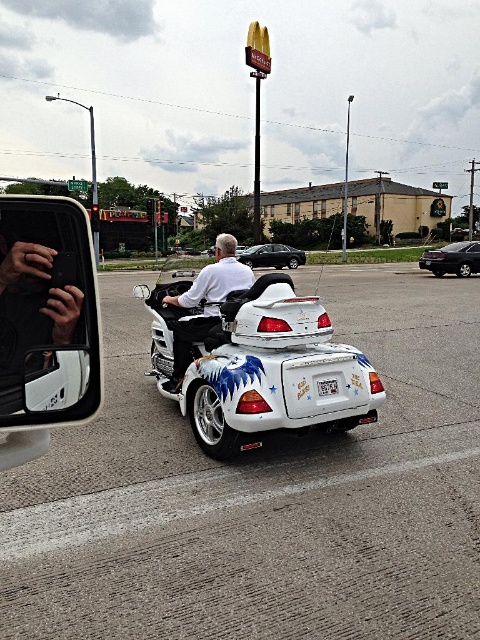
You are a delivery person needing to park your delivery van between the shiny black sedan at right and the white glossy license plate at rear. Can you fit your van there?

The shiny black sedan at right is positioned over the white glossy license plate at rear, meaning there is no space between them for the van to park.

You are a delivery driver who needs to park your vehicle between the shiny black sedan at right and the white glossy license plate at rear. The parking space between them is 21.70 meters long. Your delivery van is 6 meters long. Can you safely park your van in this space without overlapping either vehicle?

The parking space between the shiny black sedan at right and the white glossy license plate at rear is 21.70 meters long. Since your delivery van is only 6 meters long, there is ample space to park without overlapping either vehicle.

You are a delivery person needing to choose between the white glossy trike at center and the white glossy motorcycle at center for a delivery route that requires carrying multiple packages. Which vehicle would be more suitable based on their sizes?

The white glossy trike at center has a larger size compared to the white glossy motorcycle at center, so it would be more suitable for carrying multiple packages due to its bigger capacity.